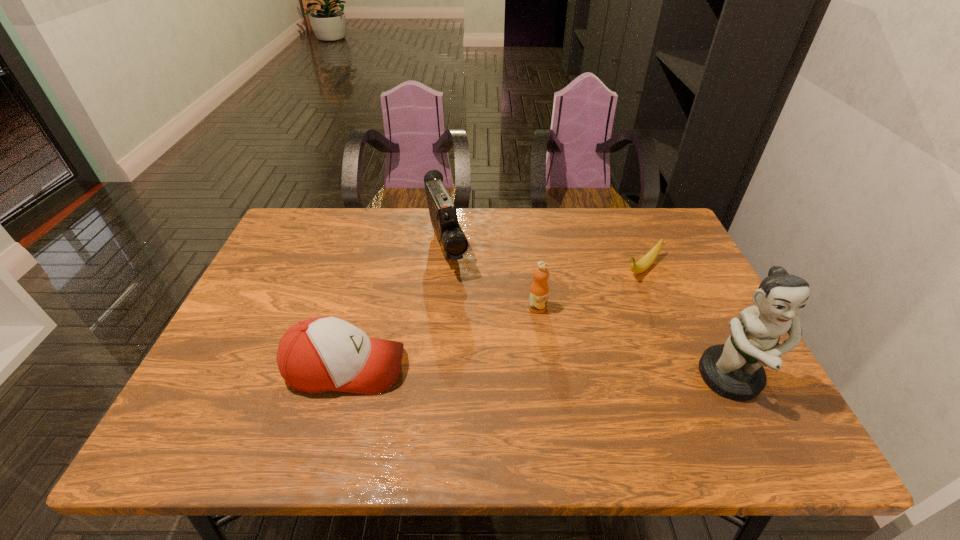
Find the location of `vacant point located between the baseball cap and the second object from left to right`. vacant point located between the baseball cap and the second object from left to right is located at coordinates (396, 308).

You are a GUI agent. You are given a task and a screenshot of the screen. Output one action in this format:
    pyautogui.click(x=<x>, y=<y>)
    Task: Click on the free spot between the figurine and the fourth shortest object
    
    Given the screenshot: What is the action you would take?
    pyautogui.click(x=589, y=314)

At what (x,y) coordinates should I click in order to perform the action: click on free space that is in between the camcorder and the tallest object. Please return your answer as a coordinate pair (x, y). The image size is (960, 540). Looking at the image, I should click on (589, 314).

You are a GUI agent. You are given a task and a screenshot of the screen. Output one action in this format:
    pyautogui.click(x=<x>, y=<y>)
    Task: Click on the free spot between the shortest object and the tallest object
    The image size is (960, 540).
    Given the screenshot: What is the action you would take?
    pyautogui.click(x=686, y=324)

Locate an element on the screen. The height and width of the screenshot is (540, 960). free space between the shortest object and the figurine is located at coordinates (686, 324).

This screenshot has height=540, width=960. In order to click on unoccupied position between the baseball cap and the shortest object in this screenshot , I will do `click(493, 318)`.

Find the location of a particular element. The height and width of the screenshot is (540, 960). vacant space that is in between the baseball cap and the third nearest object is located at coordinates (442, 338).

This screenshot has height=540, width=960. Identify the location of free space between the shortest object and the tallest object. (686, 324).

Locate an element on the screen. The width and height of the screenshot is (960, 540). vacant space in between the figurine and the shortest object is located at coordinates (686, 324).

At what (x,y) coordinates should I click in order to perform the action: click on free point between the camcorder and the baseball cap. Please return your answer as a coordinate pair (x, y). The height and width of the screenshot is (540, 960). Looking at the image, I should click on point(396,308).